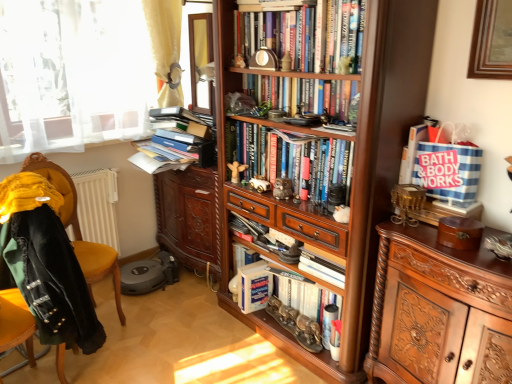
What do you see at coordinates (353, 182) in the screenshot?
I see `wooden bookcase at center` at bounding box center [353, 182].

Measure the distance between point (460, 210) and camera.

The depth of point (460, 210) is 1.59 meters.

Image resolution: width=512 pixels, height=384 pixels. What do you see at coordinates (282, 189) in the screenshot?
I see `matte brown owl at center, arranged as the 3th toy when viewed from the back` at bounding box center [282, 189].

At what (x,y) coordinates should I click in order to perform the action: click on wooden bookcase at center. Please return your answer as a coordinate pair (x, y). The image size is (512, 384). Looking at the image, I should click on (353, 182).

Which of these two, blue striped tote bag at upper right, the second book in the bottom-to-top sequence, or hardcover books at center, which is counted as the fifth book, starting from the bottom, is wider?

Wider between the two is hardcover books at center, which is counted as the fifth book, starting from the bottom.

Who is taller, blue striped tote bag at upper right, the 4th book from the top, or hardcover books at center, the first book positioned from the top?

Standing taller between the two is hardcover books at center, the first book positioned from the top.

Which is more to the left, blue striped tote bag at upper right, the second book in the bottom-to-top sequence, or hardcover books at center, which is counted as the fifth book, starting from the bottom?

hardcover books at center, which is counted as the fifth book, starting from the bottom.

Can you tell me how much blue striped tote bag at upper right, the second book in the bottom-to-top sequence, and hardcover books at center, which is counted as the fifth book, starting from the bottom, differ in facing direction?

The angle between the facing direction of blue striped tote bag at upper right, the second book in the bottom-to-top sequence, and the facing direction of hardcover books at center, which is counted as the fifth book, starting from the bottom, is 4.34 degrees.

Which of these two, hardcover books at center, marked as the 4th book in a bottom-to-top arrangement, or white paper book at center, which ranks as the fifth book in top-to-bottom order, is wider?

hardcover books at center, marked as the 4th book in a bottom-to-top arrangement, is wider.

Is hardcover books at center, marked as the 4th book in a bottom-to-top arrangement, closer to camera compared to white paper book at center, which ranks as the fifth book in top-to-bottom order?

Yes, it is.

Which is less distant, [239,274] or [298,290]?

Point [239,274] is positioned farther from the camera compared to point [298,290].

From the image's perspective, which is above, white matte paperback book at center or metallic silver magazine at center?

white matte paperback book at center is shown above in the image.

Is white matte paperback book at center situated inside metallic silver magazine at center or outside?

white matte paperback book at center is not enclosed by metallic silver magazine at center.

Between white matte paperback book at center and metallic silver magazine at center, which one has more height?

Standing taller between the two is white matte paperback book at center.

Does point (259, 19) come farther from viewer compared to point (242, 169)?

No.

From the image's perspective, which is below, hardcover books at center, which is counted as the fifth book, starting from the bottom, or wooden figurine at center, which is counted as the first toy, starting from the back?

wooden figurine at center, which is counted as the first toy, starting from the back, appears lower in the image.

In the image, is hardcover books at center, the first book positioned from the top, positioned in front of or behind wooden figurine at center, the 3th toy viewed from the front?

Clearly, hardcover books at center, the first book positioned from the top, is in front of wooden figurine at center, the 3th toy viewed from the front.

Could you tell me if matte brown owl at center, which is counted as the 1th toy, starting from the right, is facing hardcover books at center, the first book positioned from the top?

No.

Between matte brown owl at center, the 1th toy positioned from the front, and hardcover books at center, the first book positioned from the top, which one has larger size?

hardcover books at center, the first book positioned from the top.

Is matte brown owl at center, arranged as the 3th toy when viewed from the back, not inside hardcover books at center, which is counted as the fifth book, starting from the bottom?

matte brown owl at center, arranged as the 3th toy when viewed from the back, lies outside hardcover books at center, which is counted as the fifth book, starting from the bottom,'s area.

Locate an element on the screen. This screenshot has width=512, height=384. book that is the 4th one above the matte brown owl at center, placed as the third toy when sorted from left to right (from a real-world perspective) is located at coordinates (305, 34).

Considering the sizes of objects wooden bookshelf at center, the third book positioned from the top, and velvet yellow chair at left in the image provided, who is bigger, wooden bookshelf at center, the third book positioned from the top, or velvet yellow chair at left?

With larger size is velvet yellow chair at left.

How different are the orientations of wooden bookshelf at center, the third book positioned from the top, and velvet yellow chair at left in degrees?

wooden bookshelf at center, the third book positioned from the top, and velvet yellow chair at left are facing 99.4 degrees away from each other.

Is velvet yellow chair at left located within wooden bookshelf at center, the third book positioned from the bottom?

No, velvet yellow chair at left is located outside of wooden bookshelf at center, the third book positioned from the bottom.

Which of these two, wooden bookshelf at center, the third book positioned from the top, or velvet yellow chair at left, is wider?

velvet yellow chair at left is wider.

Does metallic silver magazine at center have a greater width compared to white matte paperback book at center?

Incorrect, the width of metallic silver magazine at center does not surpass that of white matte paperback book at center.

From the image's perspective, which one is positioned lower, metallic silver magazine at center or white matte paperback book at center?

From the image's view, metallic silver magazine at center is below.

Does metallic silver magazine at center appear on the left side of white matte paperback book at center?

No, metallic silver magazine at center is not to the left of white matte paperback book at center.

Is metallic silver magazine at center positioned with its back to white matte paperback book at center?

No, metallic silver magazine at center is not facing away from white matte paperback book at center.

The height and width of the screenshot is (384, 512). Find the location of `the 3rd book positioned above the blue striped tote bag at upper right, the second book in the bottom-to-top sequence (from the image's perspective)`. the 3rd book positioned above the blue striped tote bag at upper right, the second book in the bottom-to-top sequence (from the image's perspective) is located at coordinates (305, 34).

Which book is the 1st one when counting from the front of the white paper book at center, which ranks as the fifth book in top-to-bottom order? Please provide its 2D coordinates.

[(302, 94)]

Looking at the image, which one is located further to polished wood cabinet at right, white paper book at center, the first book positioned from the bottom, or metallic gold car at center, acting as the 2th toy starting from the front?

The object further to polished wood cabinet at right is metallic gold car at center, acting as the 2th toy starting from the front.

Estimate the real-world distances between objects in this image. Which object is closer to hardcover books at center, the second book viewed from the top, wooden bookshelf at center, the third book positioned from the top, or wooden bookcase at center?

wooden bookshelf at center, the third book positioned from the top, lies closer to hardcover books at center, the second book viewed from the top, than the other object.

Based on their spatial positions, is wooden figurine at center, the 3th toy viewed from the right, or hardcover books at center, which is counted as the fifth book, starting from the bottom, further from metallic silver magazine at center?

hardcover books at center, which is counted as the fifth book, starting from the bottom, is further to metallic silver magazine at center.

Based on their spatial positions, is wooden figurine at center, the 3th toy viewed from the right, or blue striped tote bag at upper right, the second book in the bottom-to-top sequence, further from wooden bookcase at center?

Based on the image, wooden figurine at center, the 3th toy viewed from the right, appears to be further to wooden bookcase at center.

When comparing their distances from metallic gold car at center, which appears as the 2th toy when viewed from the left, does white matte paperback book at center or blue striped tote bag at upper right, the 4th book from the top, seem closer?

white matte paperback book at center is positioned closer to the anchor metallic gold car at center, which appears as the 2th toy when viewed from the left.

Looking at the image, which one is located further to matte brown owl at center, which is counted as the 1th toy, starting from the right, metallic silver magazine at center or wooden figurine at center, the 3th toy viewed from the right?

Among the two, metallic silver magazine at center is located further to matte brown owl at center, which is counted as the 1th toy, starting from the right.

Which object lies further to the anchor point polished wood cabinet at right, hardcover books at center, marked as the 4th book in a bottom-to-top arrangement, or white paper book at center, which ranks as the fifth book in top-to-bottom order?

hardcover books at center, marked as the 4th book in a bottom-to-top arrangement, lies further to polished wood cabinet at right than the other object.

Which object lies nearer to the anchor point metallic gold car at center, which appears as the 2th toy when viewed from the left, hardcover books at center, which is counted as the fifth book, starting from the bottom, or wooden bookshelf at center, the third book positioned from the bottom?

wooden bookshelf at center, the third book positioned from the bottom.

Image resolution: width=512 pixels, height=384 pixels. Identify the location of paperback book between velvet yellow chair at left and wooden bookcase at center from left to right. (254, 287).

The width and height of the screenshot is (512, 384). I want to click on paperback book between hardcover books at center, the first book positioned from the top, and polished wood cabinet at right vertically, so click(254, 287).

Locate an element on the screen. book between metallic gold car at center, the second toy in the right-to-left sequence, and metallic silver magazine at center vertically is located at coordinates (322, 266).

You are a GUI agent. You are given a task and a screenshot of the screen. Output one action in this format:
    pyautogui.click(x=<x>, y=<y>)
    Task: Click on the magazine located between velvet yellow chair at left and wooden bookshelf at center, the third book positioned from the top, in the left-right direction
    The image size is (512, 384).
    Given the screenshot: What is the action you would take?
    pyautogui.click(x=302, y=309)